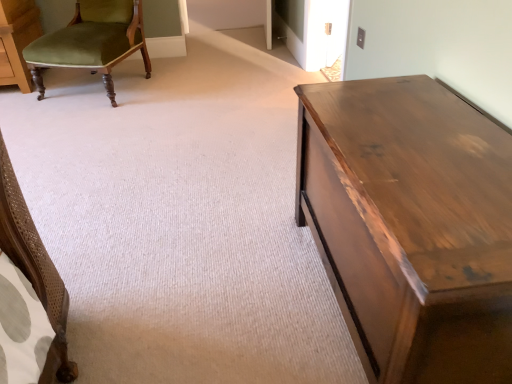
At what (x,y) coordinates should I click in order to perform the action: click on unoccupied area in front of green velvet chair at upper left. Please return your answer as a coordinate pair (x, y). Looking at the image, I should click on (87, 119).